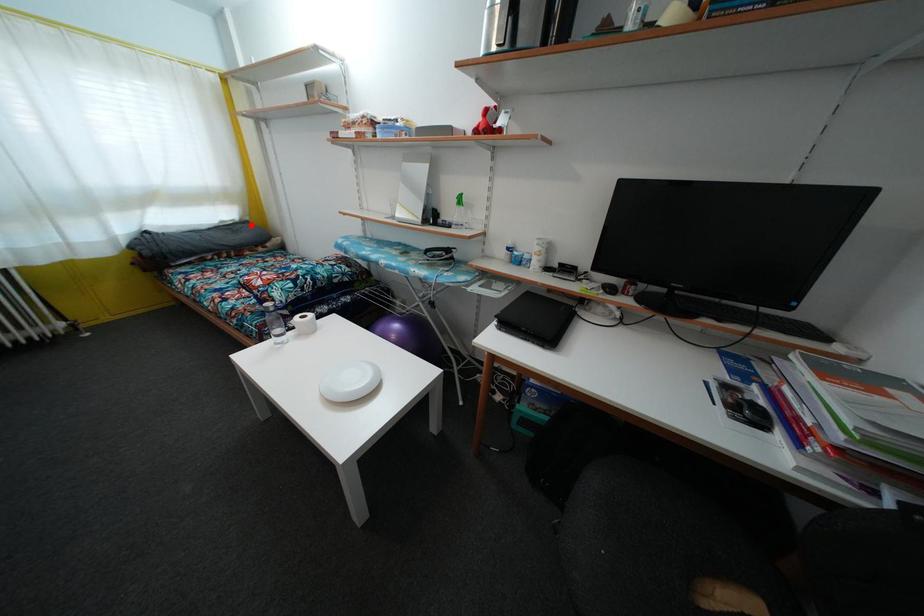
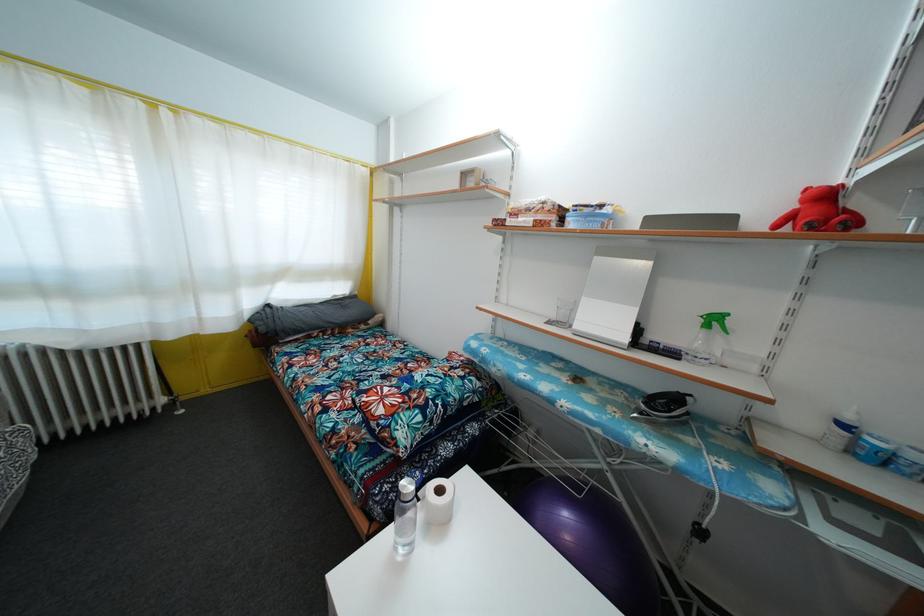
Find the pixel in the second image that matches the highlighted location in the first image.

(359, 300)